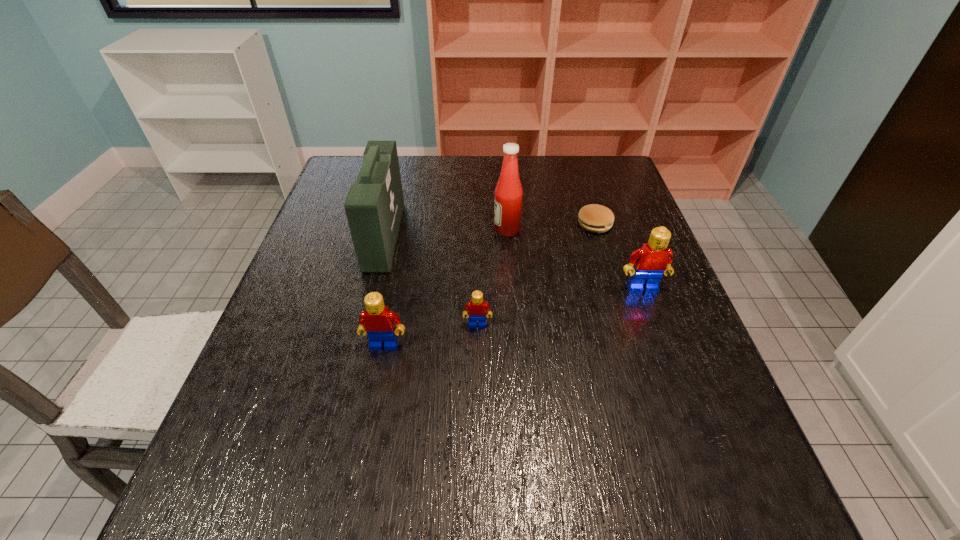
At what (x,y) coordinates should I click in order to perform the action: click on free region located on the front-facing side of the second farthest Lego. Please return your answer as a coordinate pair (x, y). The width and height of the screenshot is (960, 540). Looking at the image, I should click on (477, 386).

Where is `vacant space located on the front-facing side of the rightmost Lego`? This screenshot has height=540, width=960. vacant space located on the front-facing side of the rightmost Lego is located at coordinates [x=665, y=351].

At what (x,y) coordinates should I click in order to perform the action: click on vacant space located 0.080m on the front-facing side of the first-aid kit. Please return your answer as a coordinate pair (x, y). The image size is (960, 540). Looking at the image, I should click on (428, 236).

Image resolution: width=960 pixels, height=540 pixels. I want to click on free space located 0.190m on the back of the shortest object, so click(x=580, y=178).

The image size is (960, 540). I want to click on free region located 0.240m on the front-facing side of the condiment, so click(405, 230).

This screenshot has width=960, height=540. I want to click on free space located on the front-facing side of the condiment, so click(x=461, y=230).

Where is `free region located on the front-facing side of the condiment`? The height and width of the screenshot is (540, 960). free region located on the front-facing side of the condiment is located at coordinates (468, 230).

At what (x,y) coordinates should I click in order to perform the action: click on Lego present at the right edge. Please return your answer as a coordinate pair (x, y). Image resolution: width=960 pixels, height=540 pixels. Looking at the image, I should click on (651, 261).

The width and height of the screenshot is (960, 540). Find the location of `patty that is at the right edge`. patty that is at the right edge is located at coordinates (595, 218).

Identify the location of free space at the far edge. The width and height of the screenshot is (960, 540). (446, 161).